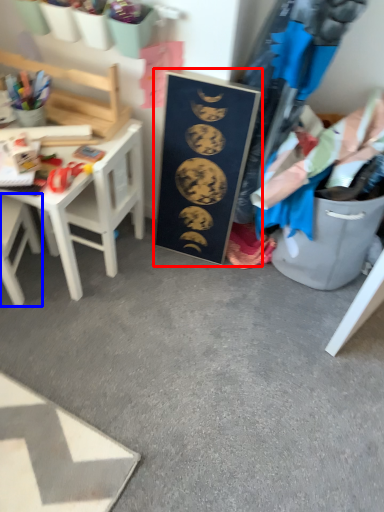
Question: Which object is further to the camera taking this photo, bulletin board (highlighted by a red box) or chair (highlighted by a blue box)?

Choices:
 (A) bulletin board
 (B) chair

Answer: (A)